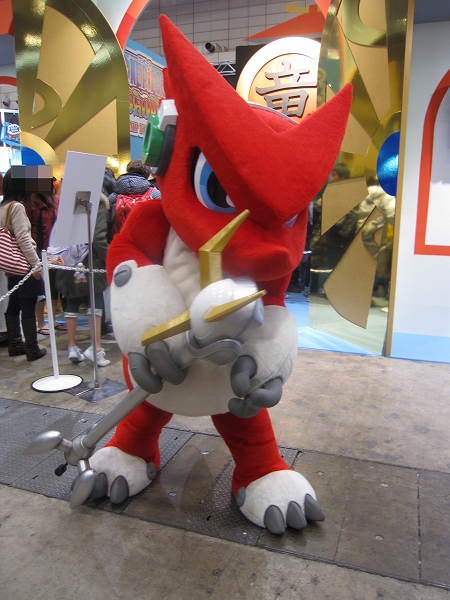
Where is `concrete floor`? The width and height of the screenshot is (450, 600). concrete floor is located at coordinates (356, 400), (376, 514), (83, 574).